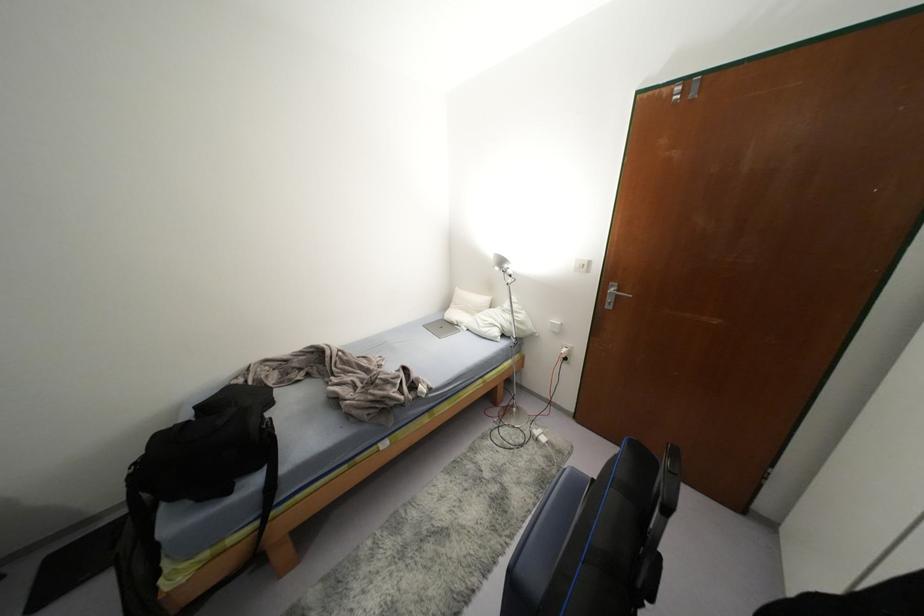
Locate an element on the screen. This screenshot has width=924, height=616. black suitcase handle is located at coordinates (670, 480).